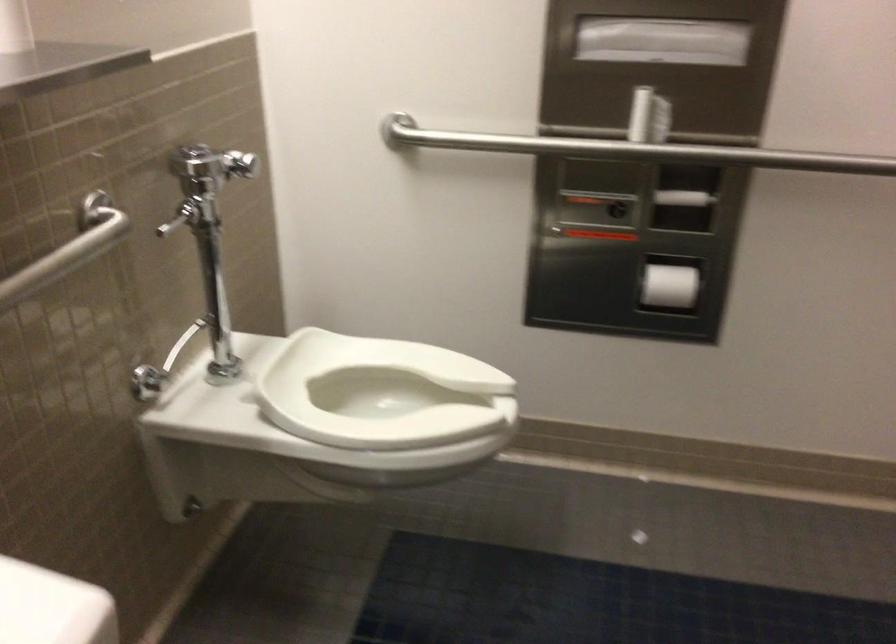
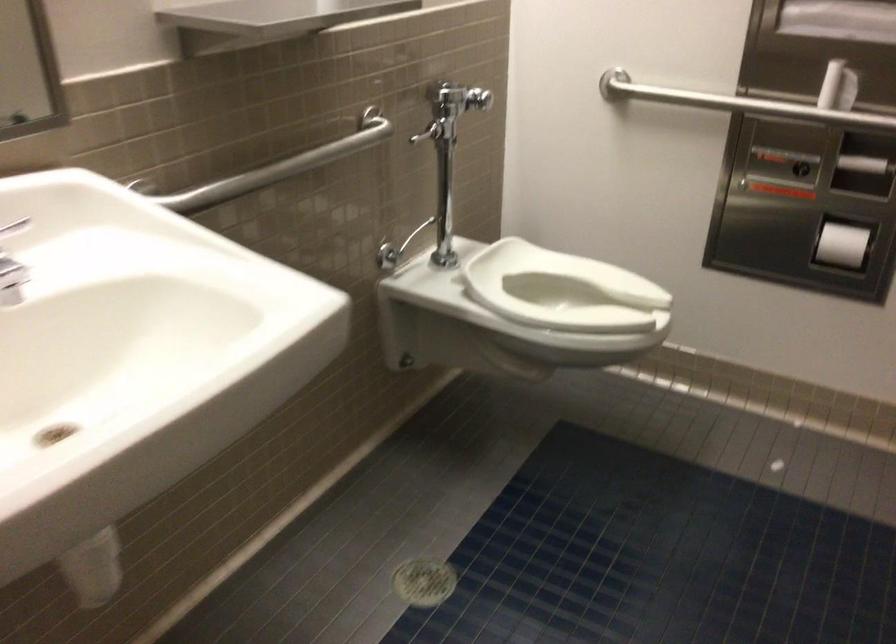
In the second image, find the point that corresponds to (381,382) in the first image.

(563, 290)